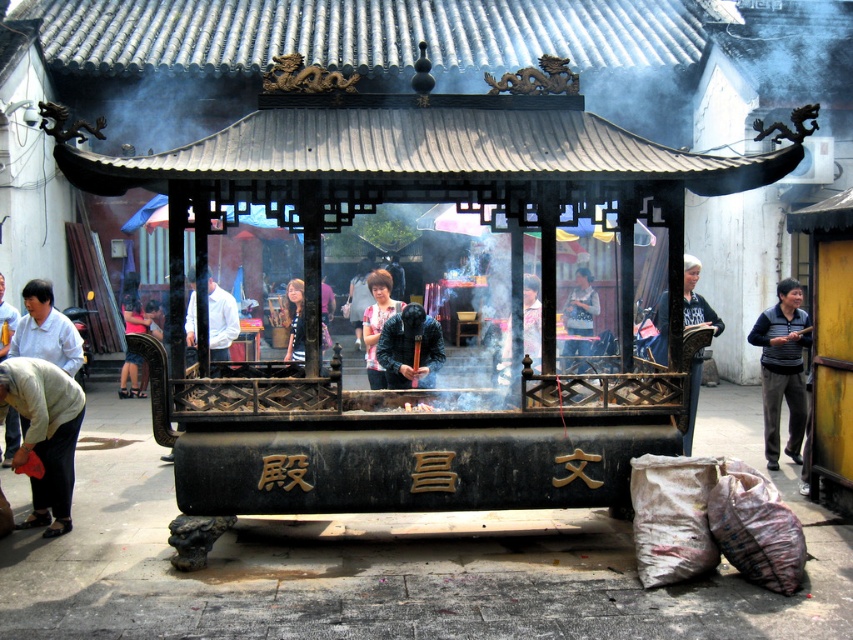
You are a visitor at this temple and want to take a photo of the white shirt at center and the striped shirt at center. Which shirt should you zoom in more on to capture both shirts clearly in the frame?

The white shirt at center is wider than the striped shirt at center, so you should zoom in more on the white shirt at center to ensure both shirts fit clearly in the frame.

You are observing a scene with a person wearing light beige fabric pants at lower left and a white shirt at center. Which clothing item is located to the left of the other?

The light beige fabric pants at lower left is positioned on the left side of white shirt at center.

You are observing a scene with a person wearing a gray sweater at right and another wearing a striped shirt at center. Which clothing item is located more to the right?

The gray sweater at right is more to the right than the striped shirt at center.